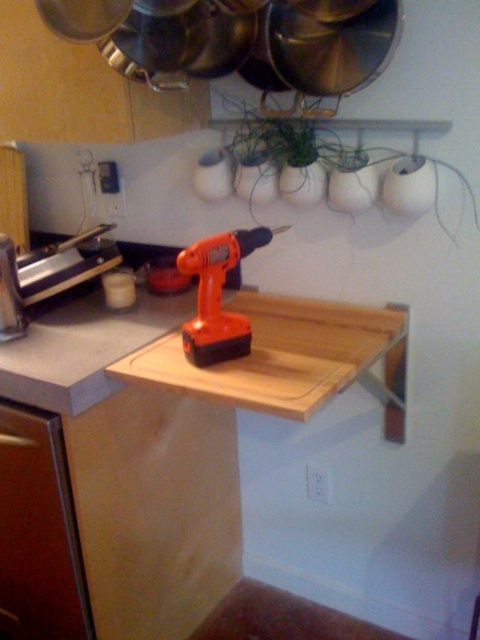
Between wooden cutting board at center and orange plastic drill at center, which one is positioned lower?

Positioned lower is wooden cutting board at center.

Does point (276, 316) lie behind point (207, 337)?

Yes, point (276, 316) is behind point (207, 337).

You are a GUI agent. You are given a task and a screenshot of the screen. Output one action in this format:
    pyautogui.click(x=<x>, y=<y>)
    Task: Click on the wooden cutting board at center
    This screenshot has width=480, height=640.
    Given the screenshot: What is the action you would take?
    pyautogui.click(x=253, y=362)